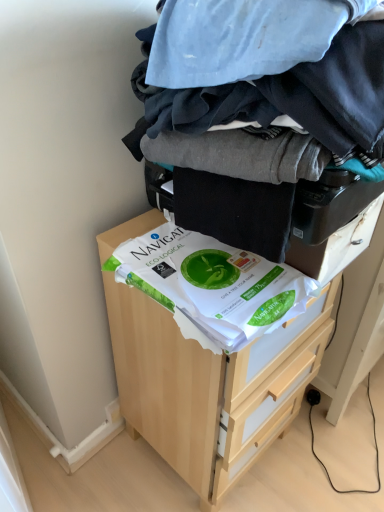
The height and width of the screenshot is (512, 384). I want to click on vacant space to the right of light wood chest of drawers at center, so click(x=330, y=454).